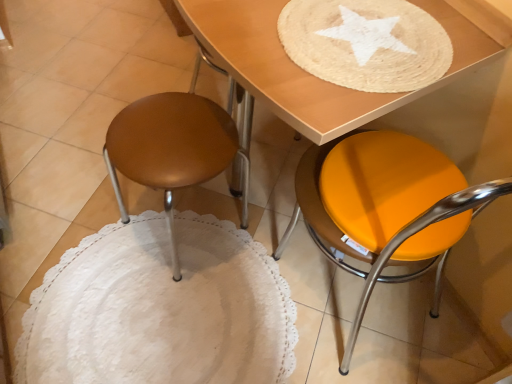
Question: Does orange matte stool at lower right come behind wooden table at upper center?

Choices:
 (A) yes
 (B) no

Answer: (B)

Question: From the image's perspective, is orange matte stool at lower right above wooden table at upper center?

Choices:
 (A) no
 (B) yes

Answer: (A)

Question: From a real-world perspective, is orange matte stool at lower right physically below wooden table at upper center?

Choices:
 (A) yes
 (B) no

Answer: (A)

Question: From a real-world perspective, is orange matte stool at lower right over wooden table at upper center?

Choices:
 (A) no
 (B) yes

Answer: (A)

Question: Would you say wooden table at upper center is part of orange matte stool at lower right's contents?

Choices:
 (A) yes
 (B) no

Answer: (A)

Question: Based on their positions, is wooden table at upper center located to the left or right of matte brown stool at left?

Choices:
 (A) left
 (B) right

Answer: (B)

Question: In terms of width, does wooden table at upper center look wider or thinner when compared to matte brown stool at left?

Choices:
 (A) thin
 (B) wide

Answer: (A)

Question: Considering their positions, is wooden table at upper center located in front of or behind matte brown stool at left?

Choices:
 (A) front
 (B) behind

Answer: (A)

Question: From their relative heights in the image, would you say wooden table at upper center is taller or shorter than matte brown stool at left?

Choices:
 (A) tall
 (B) short

Answer: (B)

Question: From the image's perspective, is matte brown stool at left located above or below wooden table at upper center?

Choices:
 (A) below
 (B) above

Answer: (A)

Question: From a real-world perspective, is matte brown stool at left physically located above or below wooden table at upper center?

Choices:
 (A) below
 (B) above

Answer: (A)

Question: Does point (121, 120) appear closer or farther from the camera than point (266, 38)?

Choices:
 (A) farther
 (B) closer

Answer: (A)

Question: Relative to wooden table at upper center, is matte brown stool at left in front or behind?

Choices:
 (A) front
 (B) behind

Answer: (B)

Question: Visually, is wooden table at upper center positioned to the left or to the right of orange matte stool at lower right?

Choices:
 (A) right
 (B) left

Answer: (B)

Question: Is wooden table at upper center situated inside orange matte stool at lower right or outside?

Choices:
 (A) inside
 (B) outside

Answer: (A)